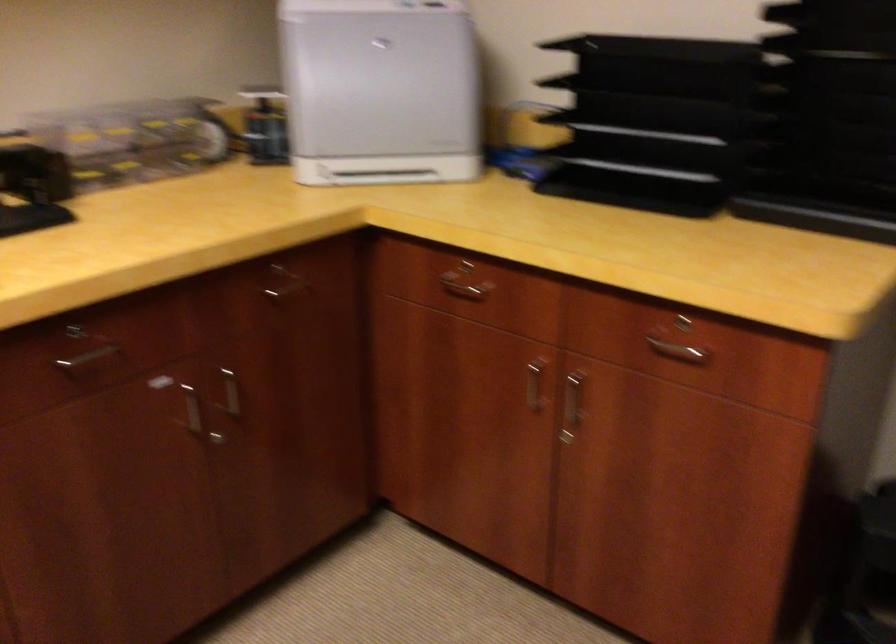
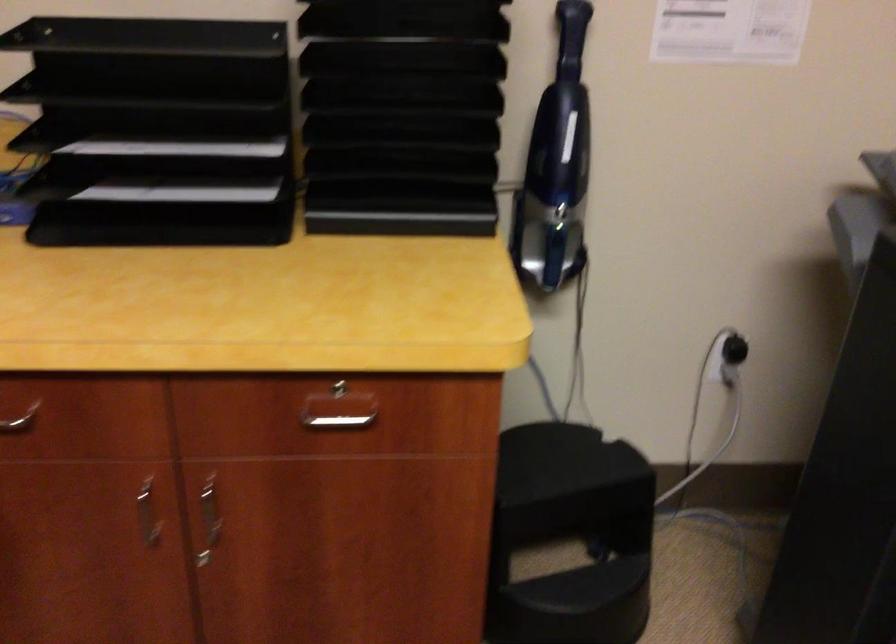
In the second image, find the point that corresponds to the point at 538,391 in the first image.

(148, 514)